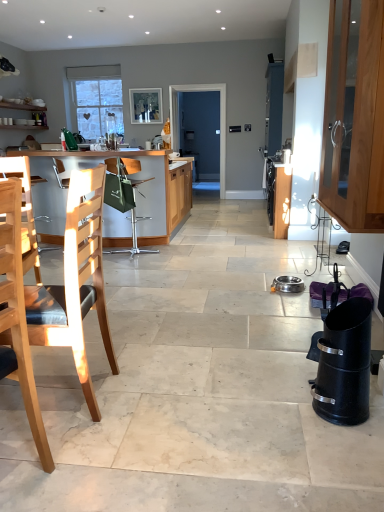
Question: From the image's perspective, does light wood chair at left, the 3th chair positioned from the back, appear lower than black matte trash can at lower right, the second appliance from the back?

Choices:
 (A) yes
 (B) no

Answer: (B)

Question: Considering the relative sizes of light wood chair at left, the 3th chair positioned from the back, and black matte trash can at lower right, the second appliance from the back, in the image provided, is light wood chair at left, the 3th chair positioned from the back, wider than black matte trash can at lower right, the second appliance from the back,?

Choices:
 (A) no
 (B) yes

Answer: (B)

Question: Is light wood chair at left, the 3th chair positioned from the back, closer to the viewer compared to black matte trash can at lower right, the second appliance from the back?

Choices:
 (A) yes
 (B) no

Answer: (A)

Question: Is light wood chair at left, the 3th chair positioned from the back, turned away from black matte trash can at lower right, which is the first appliance from front to back?

Choices:
 (A) yes
 (B) no

Answer: (B)

Question: Considering the relative sizes of light wood chair at left, the 3th chair positioned from the back, and black matte trash can at lower right, the second appliance from the back, in the image provided, is light wood chair at left, the 3th chair positioned from the back, taller than black matte trash can at lower right, the second appliance from the back,?

Choices:
 (A) yes
 (B) no

Answer: (A)

Question: Relative to light wood chair at left, which is counted as the 2th chair, starting from the front, is black matte trash can at lower right, the second appliance from the back, in front or behind?

Choices:
 (A) behind
 (B) front

Answer: (A)

Question: From a real-world perspective, is black matte trash can at lower right, which is the first appliance from front to back, physically located above or below light wood chair at left, the second chair viewed from the back?

Choices:
 (A) above
 (B) below

Answer: (B)

Question: Does point (322, 352) appear closer or farther from the camera than point (49, 309)?

Choices:
 (A) closer
 (B) farther

Answer: (A)

Question: Is black matte trash can at lower right, which is the first appliance from front to back, bigger or smaller than light wood chair at left, which is counted as the 2th chair, starting from the front?

Choices:
 (A) big
 (B) small

Answer: (B)

Question: Is point (160, 115) closer or farther from the camera than point (339, 404)?

Choices:
 (A) closer
 (B) farther

Answer: (B)

Question: Do you think matte wooden picture frame at upper center is within black matte trash can at lower right, which is the first appliance from front to back, or outside of it?

Choices:
 (A) inside
 (B) outside

Answer: (B)

Question: Considering the positions of matte wooden picture frame at upper center and black matte trash can at lower right, which is the first appliance from front to back, in the image, is matte wooden picture frame at upper center wider or thinner than black matte trash can at lower right, which is the first appliance from front to back,?

Choices:
 (A) thin
 (B) wide

Answer: (A)

Question: From their relative heights in the image, would you say matte wooden picture frame at upper center is taller or shorter than black matte trash can at lower right, the second appliance from the back?

Choices:
 (A) short
 (B) tall

Answer: (B)

Question: Choose the correct answer: Is wooden cabinet at right inside black matte trash can at lower right, which is the first appliance from front to back, or outside it?

Choices:
 (A) outside
 (B) inside

Answer: (A)

Question: Is wooden cabinet at right taller or shorter than black matte trash can at lower right, the second appliance from the back?

Choices:
 (A) tall
 (B) short

Answer: (A)